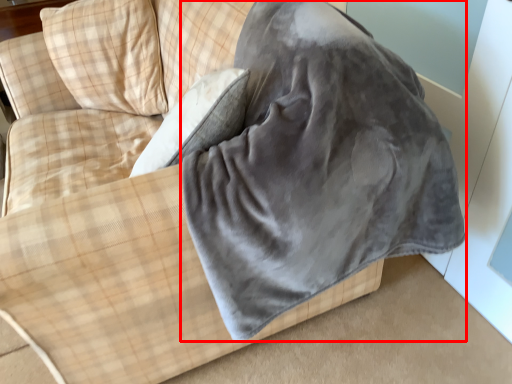
Question: From the image, what is the correct spatial relationship of sleeping bag (annotated by the red box) in relation to pillow?

Choices:
 (A) right
 (B) left

Answer: (A)